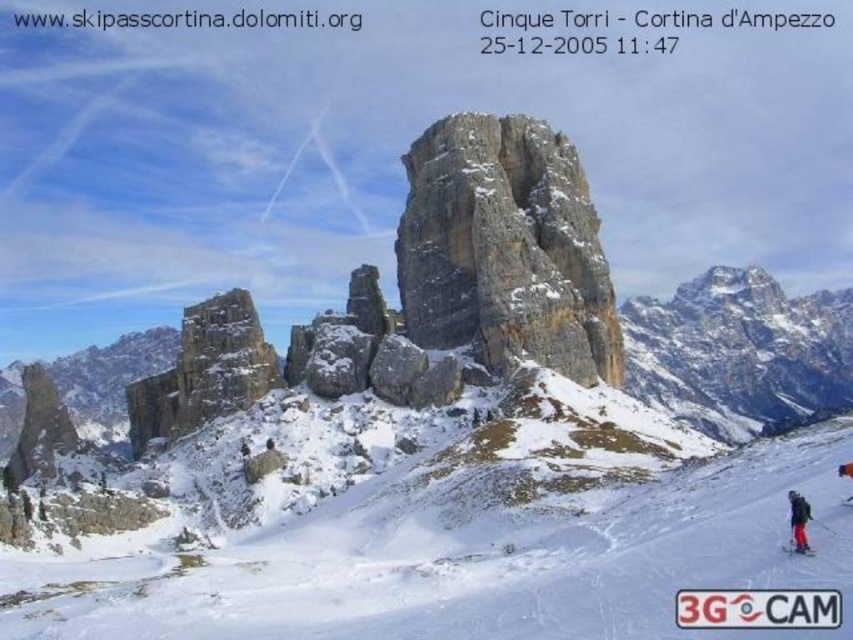
Can you confirm if gray rocky cliff at center is bigger than white plastic ski at lower right?

Indeed, gray rocky cliff at center has a larger size compared to white plastic ski at lower right.

Is gray rocky cliff at center thinner than white plastic ski at lower right?

No, gray rocky cliff at center is not thinner than white plastic ski at lower right.

Locate an element on the screen. This screenshot has width=853, height=640. gray rocky cliff at center is located at coordinates (505, 248).

Can you confirm if gray rocky cliff at center is wider than black ski suit at lower right?

Yes.

Does gray rocky cliff at center appear under black ski suit at lower right?

Incorrect, gray rocky cliff at center is not positioned below black ski suit at lower right.

Is point (517, 250) in front of point (848, 465)?

No, (517, 250) is further to viewer.

This screenshot has height=640, width=853. What are the coordinates of `gray rocky cliff at center` in the screenshot? It's located at (505, 248).

Can you confirm if orange ski suit at lower right is positioned below black ski suit at lower right?

Indeed, orange ski suit at lower right is positioned under black ski suit at lower right.

Is orange ski suit at lower right shorter than black ski suit at lower right?

In fact, orange ski suit at lower right may be taller than black ski suit at lower right.

Does point (804, 550) come in front of point (845, 468)?

Yes, point (804, 550) is in front of point (845, 468).

Where is `orange ski suit at lower right`? orange ski suit at lower right is located at coordinates (798, 520).